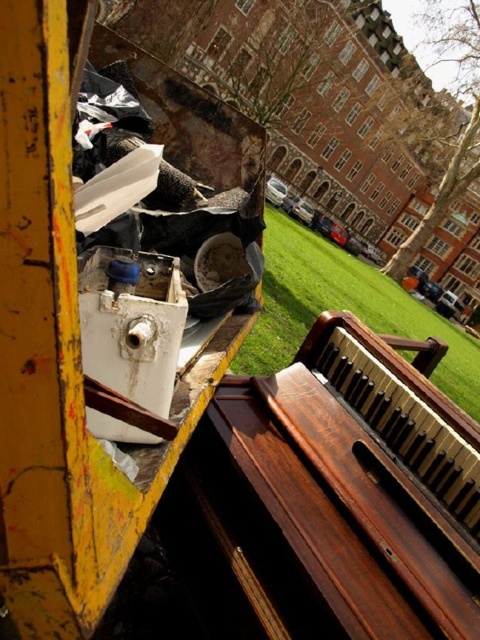
Question: Can you confirm if wooden polished piano at lower right is wider than green grass at center?

Choices:
 (A) yes
 (B) no

Answer: (B)

Question: Is wooden polished piano at lower right to the left of green grass at center from the viewer's perspective?

Choices:
 (A) yes
 (B) no

Answer: (A)

Question: Does wooden polished piano at lower right appear over green grass at center?

Choices:
 (A) no
 (B) yes

Answer: (A)